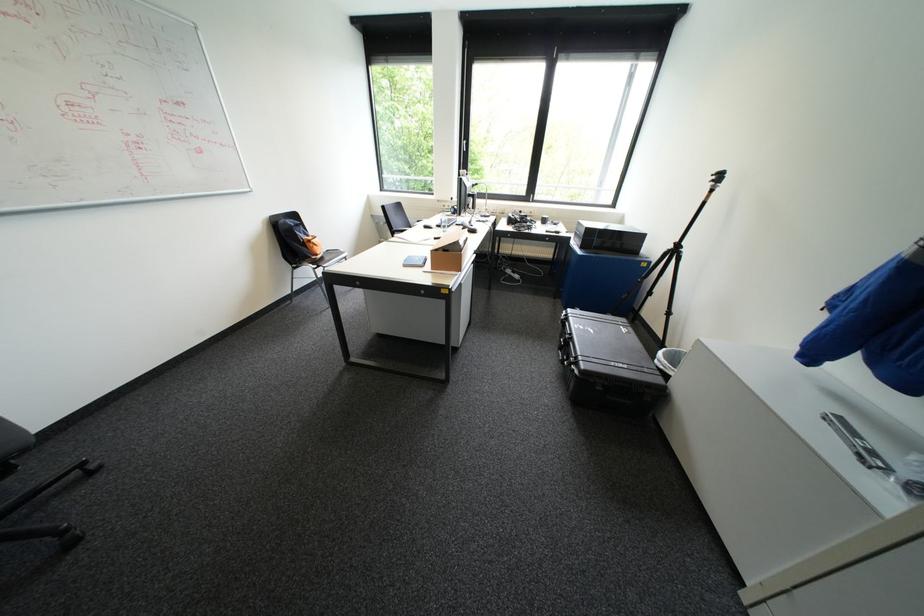
The width and height of the screenshot is (924, 616). What are the coordinates of `black case handle` in the screenshot? It's located at (558, 351).